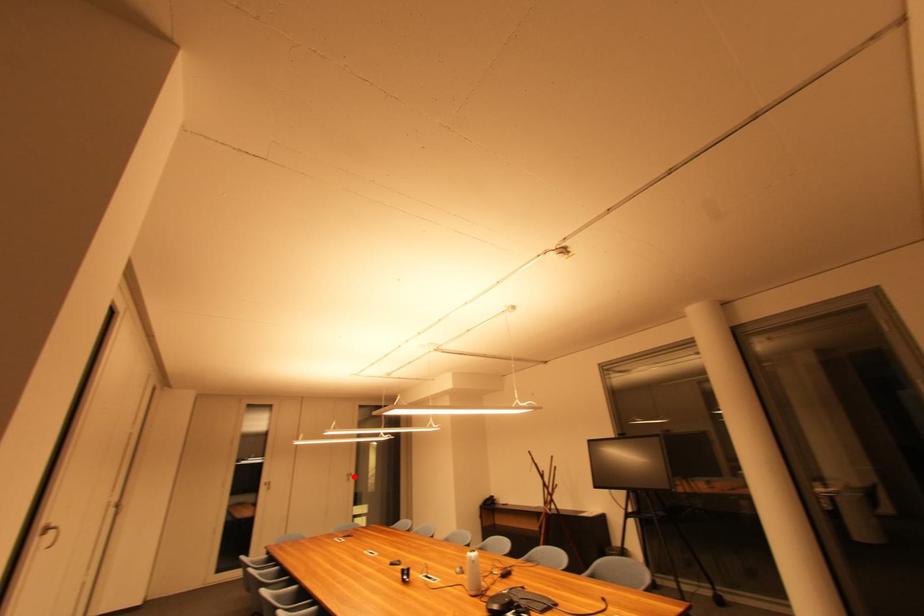
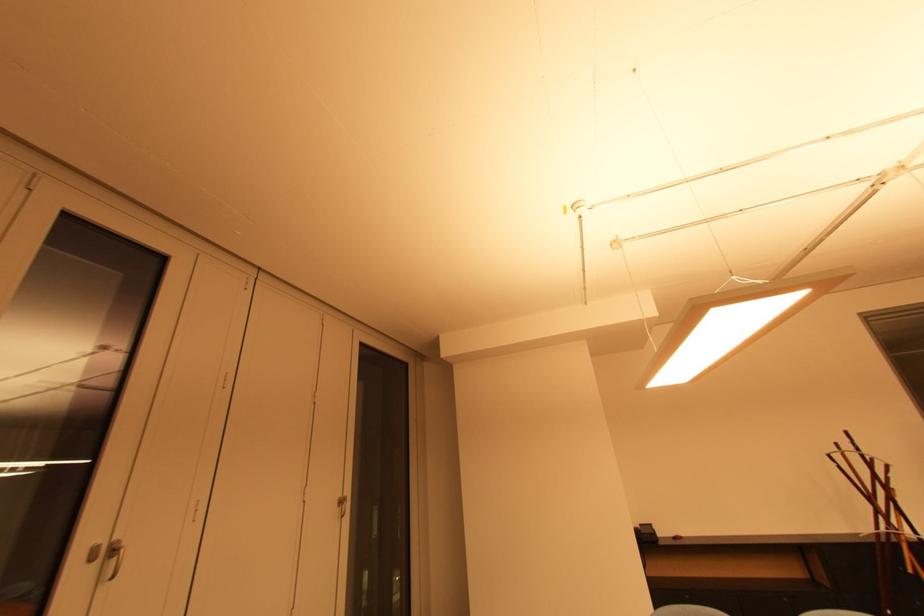
Where in the second image is the point corresponding to the highlighted location from the first image?

(346, 504)